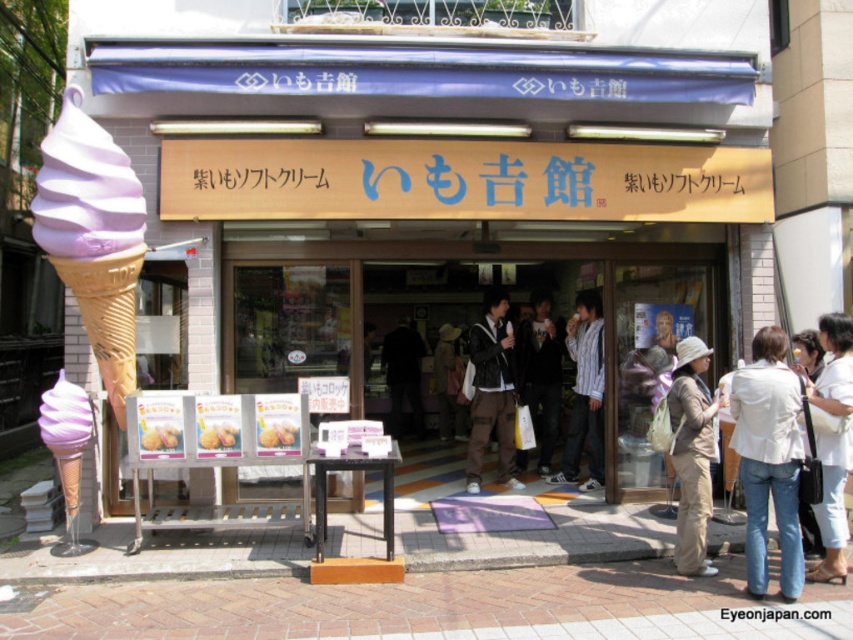
Can you confirm if matte purple ice cream cone at lower left is positioned to the right of dark blue jacket at center?

In fact, matte purple ice cream cone at lower left is to the left of dark blue jacket at center.

Who is positioned more to the right, matte purple ice cream cone at lower left or dark blue jacket at center?

From the viewer's perspective, dark blue jacket at center appears more on the right side.

Who is more distant from viewer, (68,433) or (399,368)?

Point (399,368)

Locate an element on the screen. matte purple ice cream cone at lower left is located at coordinates (67, 451).

Describe the element at coordinates (445, 192) in the screenshot. I see `matte purple ice cream cone at center` at that location.

Based on the photo, does matte purple ice cream cone at center have a lesser height compared to matte black jacket at center?

Yes, matte purple ice cream cone at center is shorter than matte black jacket at center.

Is point (552, 145) closer to camera compared to point (543, 376)?

Yes, it is.

In order to click on matte purple ice cream cone at center in this screenshot , I will do `click(445, 192)`.

Who is more distant from viewer, (405,388) or (439,339)?

The point (439,339) is more distant.

Can you confirm if dark blue jacket at center is shorter than brown leather jacket at center?

Indeed, dark blue jacket at center has a lesser height compared to brown leather jacket at center.

Who is more distant from viewer, (393,344) or (444,340)?

The point (444,340) is more distant.

The image size is (853, 640). In order to click on dark blue jacket at center in this screenshot , I will do `click(403, 372)`.